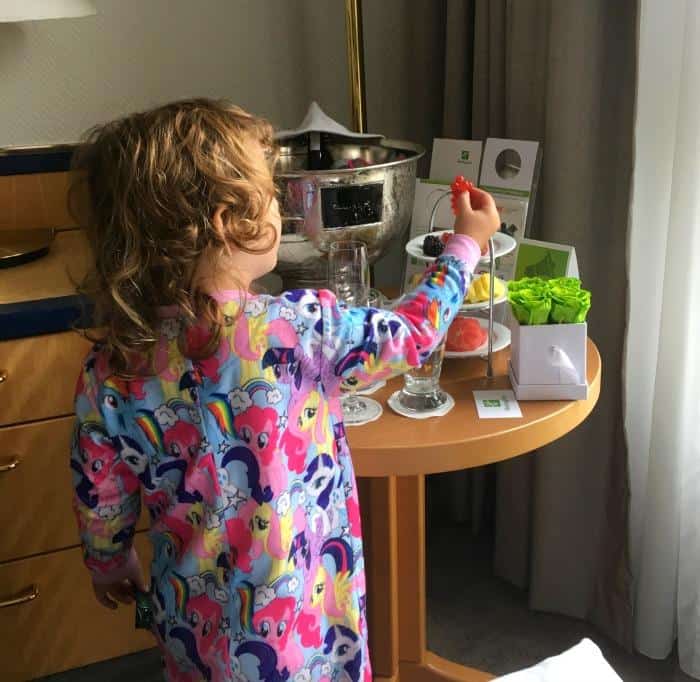
Where is `table`? The width and height of the screenshot is (700, 682). table is located at coordinates (428, 427).